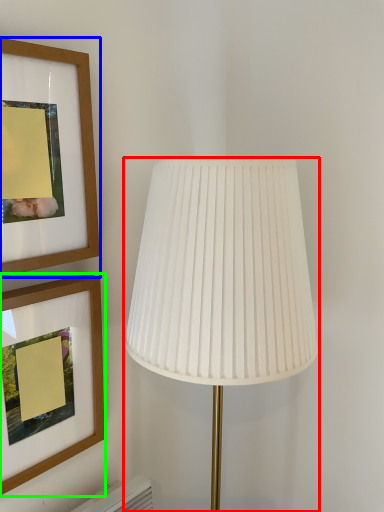
Question: Which object is positioned farthest from lamp (highlighted by a red box)? Select from picture frame (highlighted by a blue box) and picture frame (highlighted by a green box).

Choices:
 (A) picture frame
 (B) picture frame

Answer: (B)